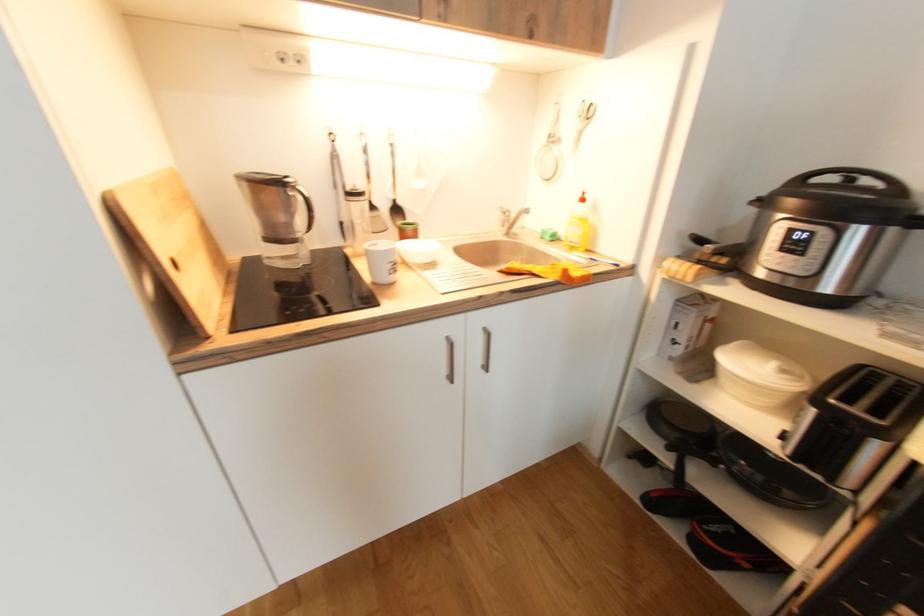
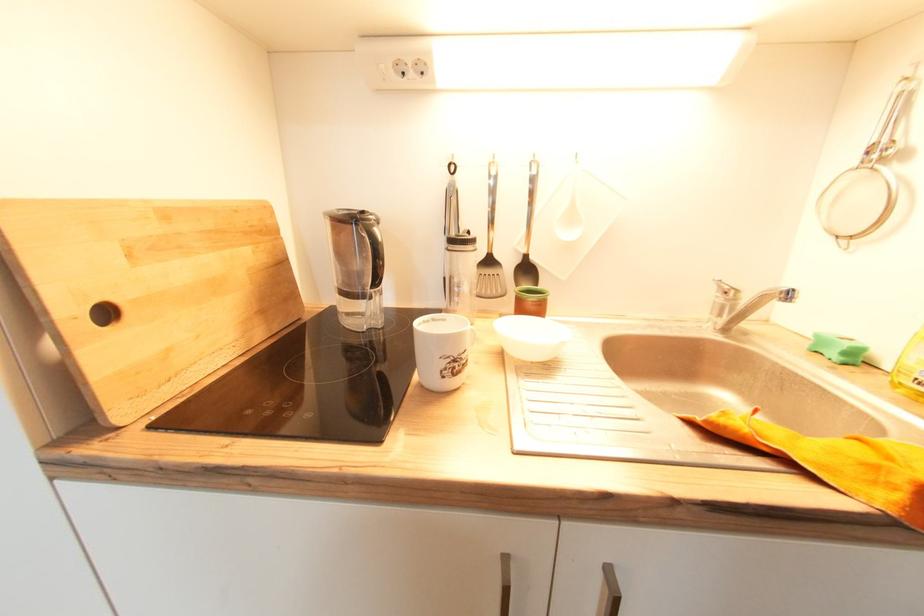
Question: The camera is either moving clockwise (left) or counter-clockwise (right) around the object. The first image is from the beginning of the video and the second image is from the end. Is the camera moving left or right when shooting the video?

Choices:
 (A) Left
 (B) Right

Answer: (B)